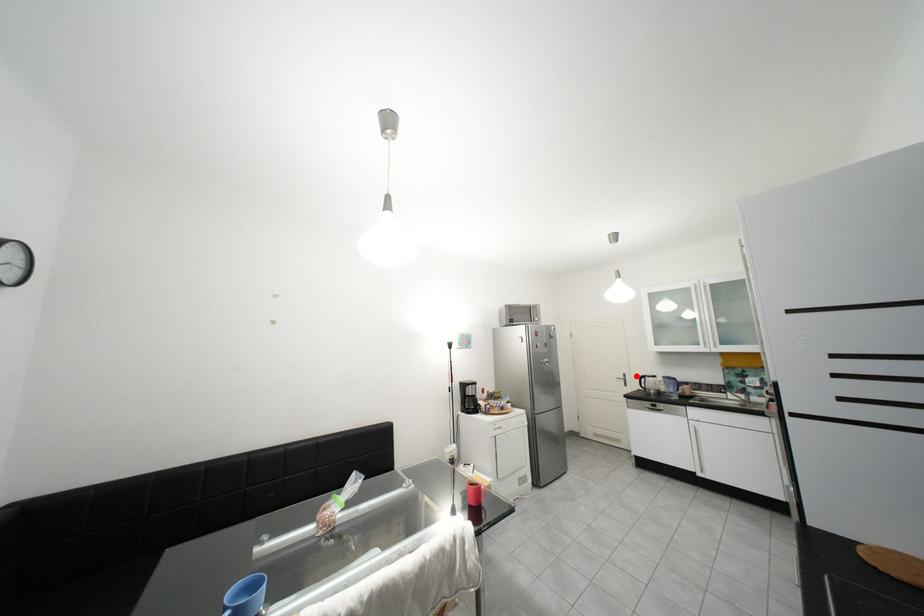
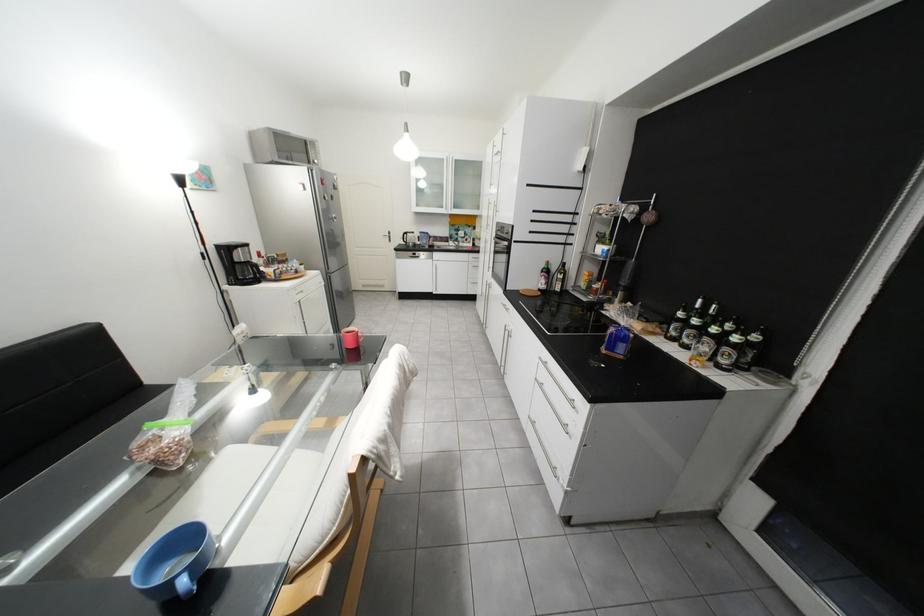
Where in the second image is the point corresponding to the highlighted location from the first image?

(402, 233)